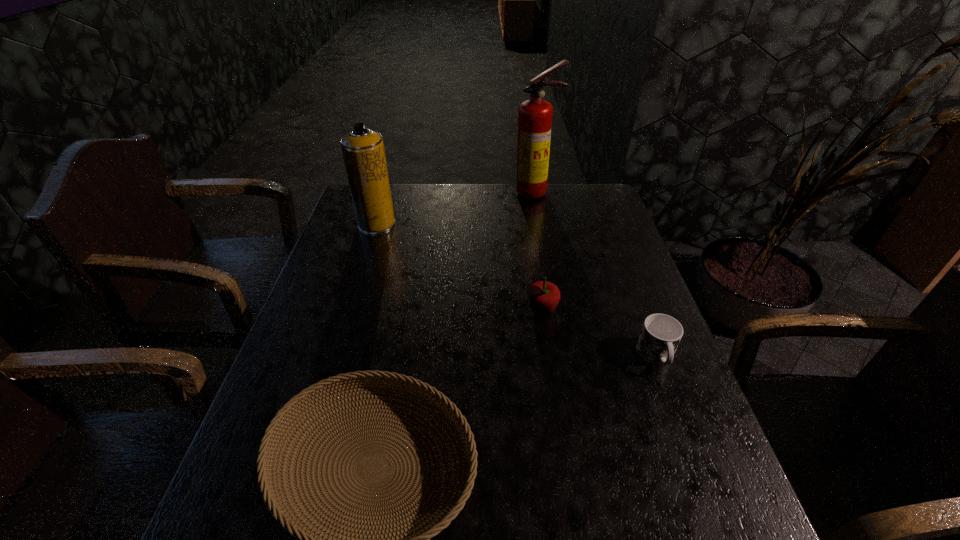
Locate an element on the screen. fire extinguisher is located at coordinates (534, 115).

This screenshot has width=960, height=540. In order to click on the farthest object in this screenshot , I will do `click(534, 115)`.

I want to click on the fourth nearest object, so click(x=363, y=151).

This screenshot has height=540, width=960. I want to click on aerosol can, so click(363, 151).

You are a GUI agent. You are given a task and a screenshot of the screen. Output one action in this format:
    pyautogui.click(x=<x>, y=<y>)
    Task: Click on the apple
    
    Given the screenshot: What is the action you would take?
    pyautogui.click(x=544, y=296)

Locate an element on the screen. The image size is (960, 540). the third shortest object is located at coordinates (544, 296).

Find the location of `cup`. cup is located at coordinates (660, 335).

Locate an element on the screen. The height and width of the screenshot is (540, 960). the fourth farthest object is located at coordinates (660, 335).

Where is `vacant space located on the front-facing side of the tallest object`? The image size is (960, 540). vacant space located on the front-facing side of the tallest object is located at coordinates (542, 228).

Locate an element on the screen. This screenshot has height=540, width=960. free space located on the front of the second tallest object is located at coordinates (364, 266).